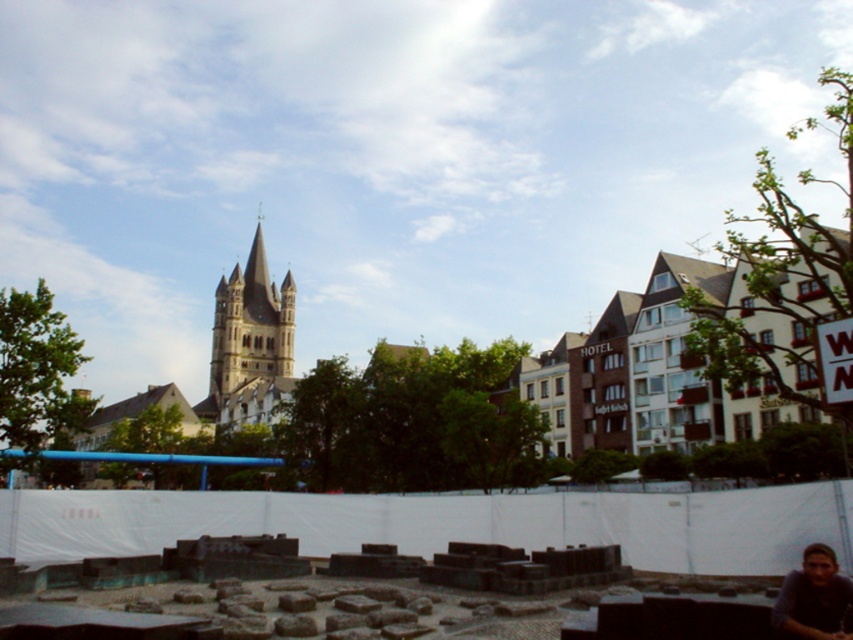
What do you see at coordinates (251, 324) in the screenshot?
I see `golden stone tower at center` at bounding box center [251, 324].

Does point (287, 308) come in front of point (836, 596)?

No, it is not.

Locate an element on the screen. This screenshot has height=640, width=853. golden stone tower at center is located at coordinates 251,324.